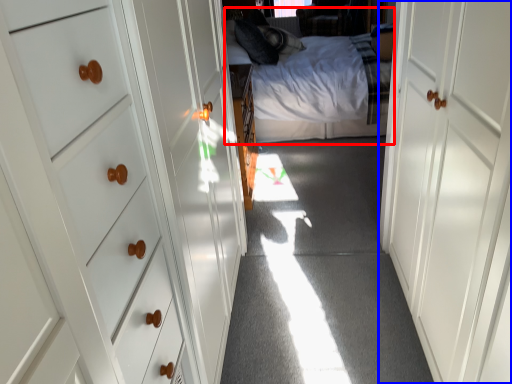
Question: Which of the following is the closest to the observer, bed (highlighted by a red box) or door (highlighted by a blue box)?

Choices:
 (A) bed
 (B) door

Answer: (B)